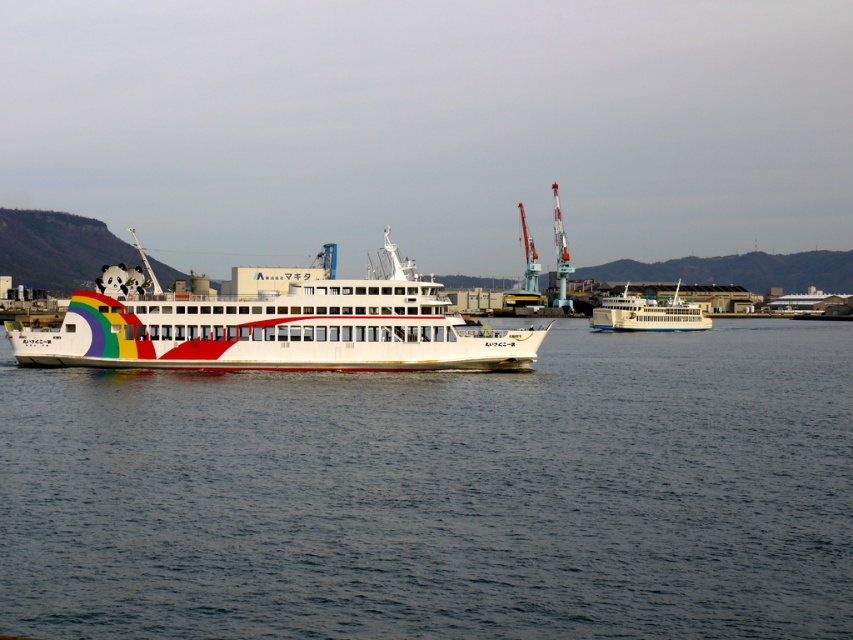
You are a crane operator at the port and need to lower a cargo container between the rainbow painted ship at center and the white glossy ferry at center. Which boat should you avoid lowering the container near due to its height?

You should avoid lowering the container near the rainbow painted ship at center because it has a greater height compared to the white glossy ferry at center, making it more likely to hit the crane or container.

You are a photographer planning to take a photo of both the rainbow painted ship at center and the white glossy ferry at center. Given their positions, which one should you focus on first to ensure both are in the frame?

You should focus on the rainbow painted ship at center first because it is closer to the viewer, allowing you to adjust the framing to include both ships in the composition.